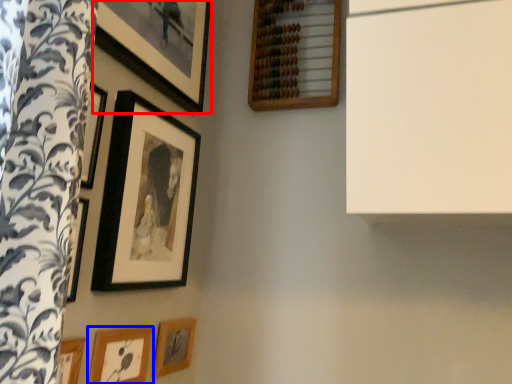
Question: Which of the following is the closest to the observer, picture frame (highlighted by a red box) or picture frame (highlighted by a blue box)?

Choices:
 (A) picture frame
 (B) picture frame

Answer: (A)